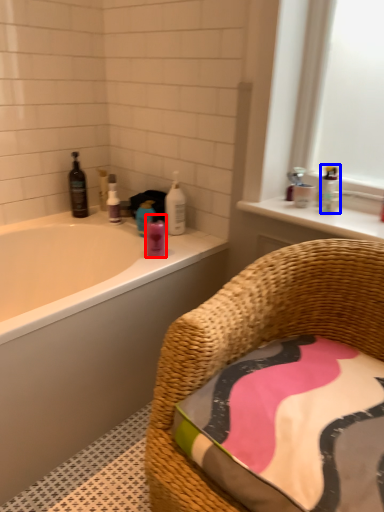
Question: Which object is closer to the camera taking this photo, toiletry (highlighted by a red box) or toiletry (highlighted by a blue box)?

Choices:
 (A) toiletry
 (B) toiletry

Answer: (A)